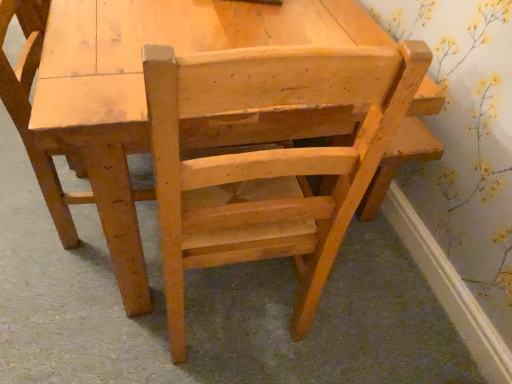
Find the location of a particular element. This screenshot has width=512, height=384. natural wood chair at center, acting as the 1th chair starting from the right is located at coordinates (144, 95).

This screenshot has width=512, height=384. What do you see at coordinates (144, 95) in the screenshot?
I see `natural wood chair at center, positioned as the 2th chair in left-to-right order` at bounding box center [144, 95].

The height and width of the screenshot is (384, 512). What do you see at coordinates (61, 149) in the screenshot?
I see `light brown wood chair at center, marked as the 1th chair in a left-to-right arrangement` at bounding box center [61, 149].

Locate an element on the screen. This screenshot has height=384, width=512. light brown wood chair at center, marked as the 1th chair in a left-to-right arrangement is located at coordinates (61, 149).

In order to face light brown wood chair at center, marked as the 1th chair in a left-to-right arrangement, should I rotate leftwards or rightwards?

To face it directly, rotate left by 20.198 degrees.

What are the coordinates of `natural wood chair at center, positioned as the 2th chair in left-to-right order` in the screenshot? It's located at (144, 95).

Based on their positions, is natural wood chair at center, acting as the 1th chair starting from the right, located to the left or right of light brown wood chair at center, placed as the second chair when sorted from right to left?

Clearly, natural wood chair at center, acting as the 1th chair starting from the right, is on the right of light brown wood chair at center, placed as the second chair when sorted from right to left, in the image.

Is natural wood chair at center, acting as the 1th chair starting from the right, further to the viewer compared to light brown wood chair at center, placed as the second chair when sorted from right to left?

No, the depth of natural wood chair at center, acting as the 1th chair starting from the right, is less than that of light brown wood chair at center, placed as the second chair when sorted from right to left.

Does point (223, 133) lie in front of point (122, 295)?

Yes.

From the image's perspective, which object appears higher, natural wood chair at center, positioned as the 2th chair in left-to-right order, or light brown wood chair at center, placed as the second chair when sorted from right to left?

From the image's view, light brown wood chair at center, placed as the second chair when sorted from right to left, is above.

From a real-world perspective, is natural wood chair at center, positioned as the 2th chair in left-to-right order, on light brown wood chair at center, placed as the second chair when sorted from right to left?

Incorrect, from a real-world perspective, natural wood chair at center, positioned as the 2th chair in left-to-right order, is lower than light brown wood chair at center, placed as the second chair when sorted from right to left.

Which of these two, natural wood chair at center, acting as the 1th chair starting from the right, or light brown wood chair at center, marked as the 1th chair in a left-to-right arrangement, is thinner?

Thinner between the two is light brown wood chair at center, marked as the 1th chair in a left-to-right arrangement.

Which of these two, natural wood chair at center, acting as the 1th chair starting from the right, or light brown wood chair at center, marked as the 1th chair in a left-to-right arrangement, stands shorter?

natural wood chair at center, acting as the 1th chair starting from the right, is shorter.

Considering the relative sizes of natural wood chair at center, acting as the 1th chair starting from the right, and light brown wood chair at center, marked as the 1th chair in a left-to-right arrangement, in the image provided, is natural wood chair at center, acting as the 1th chair starting from the right, smaller than light brown wood chair at center, marked as the 1th chair in a left-to-right arrangement,?

Incorrect, natural wood chair at center, acting as the 1th chair starting from the right, is not smaller in size than light brown wood chair at center, marked as the 1th chair in a left-to-right arrangement.

Is natural wood chair at center, acting as the 1th chair starting from the right, located outside light brown wood chair at center, placed as the second chair when sorted from right to left?

natural wood chair at center, acting as the 1th chair starting from the right, lies outside light brown wood chair at center, placed as the second chair when sorted from right to left,'s area.

Would you consider natural wood chair at center, positioned as the 2th chair in left-to-right order, to be distant from light brown wood chair at center, placed as the second chair when sorted from right to left?

No, natural wood chair at center, positioned as the 2th chair in left-to-right order, is not far from light brown wood chair at center, placed as the second chair when sorted from right to left.

Is natural wood chair at center, acting as the 1th chair starting from the right, looking in the opposite direction of light brown wood chair at center, placed as the second chair when sorted from right to left?

No, natural wood chair at center, acting as the 1th chair starting from the right,'s orientation is not away from light brown wood chair at center, placed as the second chair when sorted from right to left.

How many degrees apart are the facing directions of natural wood chair at center, acting as the 1th chair starting from the right, and light brown wood chair at center, placed as the second chair when sorted from right to left?

85.6 degrees separate the facing orientations of natural wood chair at center, acting as the 1th chair starting from the right, and light brown wood chair at center, placed as the second chair when sorted from right to left.

From the picture: Measure the distance from natural wood chair at center, positioned as the 2th chair in left-to-right order, to light brown wood chair at center, placed as the second chair when sorted from right to left.

natural wood chair at center, positioned as the 2th chair in left-to-right order, and light brown wood chair at center, placed as the second chair when sorted from right to left, are 7.09 inches apart.

I want to click on chair on the left of natural wood chair at center, positioned as the 2th chair in left-to-right order, so click(61, 149).

Considering the positions of objects light brown wood chair at center, placed as the second chair when sorted from right to left, and natural wood chair at center, acting as the 1th chair starting from the right, in the image provided, who is more to the right, light brown wood chair at center, placed as the second chair when sorted from right to left, or natural wood chair at center, acting as the 1th chair starting from the right,?

Positioned to the right is natural wood chair at center, acting as the 1th chair starting from the right.

Which object is closer to the camera, light brown wood chair at center, marked as the 1th chair in a left-to-right arrangement, or natural wood chair at center, positioned as the 2th chair in left-to-right order?

natural wood chair at center, positioned as the 2th chair in left-to-right order, is closer to the camera.

Which is less distant, (4,1) or (293,128)?

The point (293,128) is in front.

From the picture: From the image's perspective, is light brown wood chair at center, marked as the 1th chair in a left-to-right arrangement, located above or below natural wood chair at center, acting as the 1th chair starting from the right?

light brown wood chair at center, marked as the 1th chair in a left-to-right arrangement, is situated higher than natural wood chair at center, acting as the 1th chair starting from the right, in the image.

From a real-world perspective, does light brown wood chair at center, marked as the 1th chair in a left-to-right arrangement, sit lower than natural wood chair at center, acting as the 1th chair starting from the right?

Incorrect, from a real-world perspective, light brown wood chair at center, marked as the 1th chair in a left-to-right arrangement, is higher than natural wood chair at center, acting as the 1th chair starting from the right.

Does light brown wood chair at center, placed as the second chair when sorted from right to left, have a lesser width compared to natural wood chair at center, acting as the 1th chair starting from the right?

Correct, the width of light brown wood chair at center, placed as the second chair when sorted from right to left, is less than that of natural wood chair at center, acting as the 1th chair starting from the right.

Which of these two, light brown wood chair at center, marked as the 1th chair in a left-to-right arrangement, or natural wood chair at center, positioned as the 2th chair in left-to-right order, stands shorter?

With less height is natural wood chair at center, positioned as the 2th chair in left-to-right order.

Looking at the image, does light brown wood chair at center, placed as the second chair when sorted from right to left, seem bigger or smaller compared to natural wood chair at center, positioned as the 2th chair in left-to-right order?

In the image, light brown wood chair at center, placed as the second chair when sorted from right to left, appears to be smaller than natural wood chair at center, positioned as the 2th chair in left-to-right order.

Is light brown wood chair at center, placed as the second chair when sorted from right to left, not inside natural wood chair at center, acting as the 1th chair starting from the right?

light brown wood chair at center, placed as the second chair when sorted from right to left, lies outside natural wood chair at center, acting as the 1th chair starting from the right,'s area.

Are light brown wood chair at center, placed as the second chair when sorted from right to left, and natural wood chair at center, positioned as the 2th chair in left-to-right order, far apart?

That's not correct — light brown wood chair at center, placed as the second chair when sorted from right to left, is a little close to natural wood chair at center, positioned as the 2th chair in left-to-right order.

Is light brown wood chair at center, placed as the second chair when sorted from right to left, turned away from natural wood chair at center, positioned as the 2th chair in left-to-right order?

No, natural wood chair at center, positioned as the 2th chair in left-to-right order, is not at the back of light brown wood chair at center, placed as the second chair when sorted from right to left.

How many degrees apart are the facing directions of light brown wood chair at center, placed as the second chair when sorted from right to left, and natural wood chair at center, positioned as the 2th chair in left-to-right order?

85.6 degrees.

Find the location of a particular element. chair behind the natural wood chair at center, positioned as the 2th chair in left-to-right order is located at coordinates 61,149.

Find the location of a particular element. chair below the light brown wood chair at center, placed as the second chair when sorted from right to left (from a real-world perspective) is located at coordinates (144, 95).

Find the location of `chair that appears below the light brown wood chair at center, placed as the second chair when sorted from right to left (from the image's perspective)`. chair that appears below the light brown wood chair at center, placed as the second chair when sorted from right to left (from the image's perspective) is located at coordinates (144, 95).